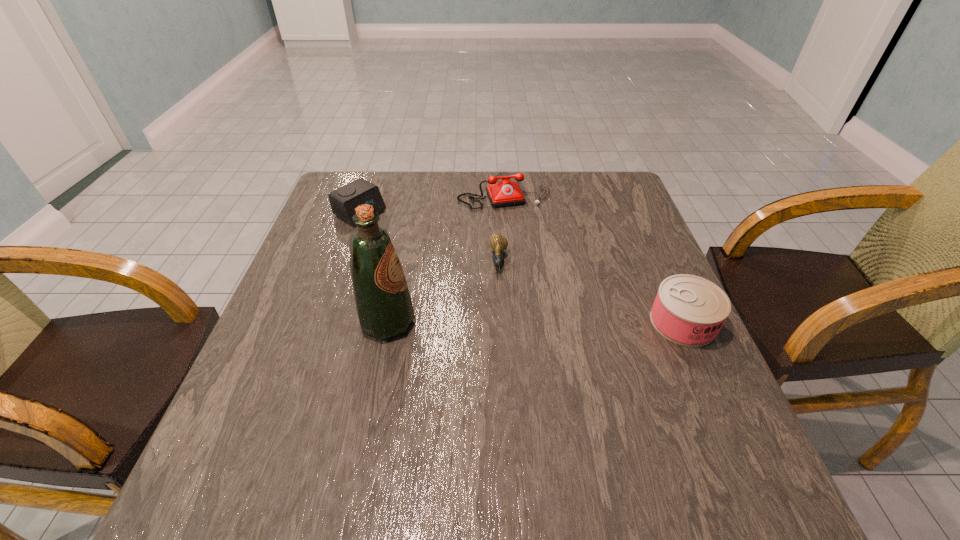
The width and height of the screenshot is (960, 540). I want to click on object present at the left edge, so click(x=344, y=200).

At what (x,y) coordinates should I click in order to perform the action: click on object that is at the right edge. Please return your answer as a coordinate pair (x, y). Looking at the image, I should click on (688, 310).

The height and width of the screenshot is (540, 960). What are the coordinates of `object located in the far left corner section of the desktop` in the screenshot? It's located at (344, 200).

In the image, there is a desktop. Identify the location of vacant region at the far edge. The width and height of the screenshot is (960, 540). (549, 173).

Find the location of a particular element. Image resolution: width=960 pixels, height=540 pixels. blank space at the near edge is located at coordinates (481, 407).

The height and width of the screenshot is (540, 960). Identify the location of free space at the left edge of the desktop. (340, 242).

Where is `vacant space at the right edge of the desktop`? vacant space at the right edge of the desktop is located at coordinates (689, 396).

Find the location of a particular element. The image size is (960, 540). blank space at the far right corner is located at coordinates (617, 178).

Identify the location of vacant space at the near right corner of the desktop. This screenshot has height=540, width=960. (716, 426).

You are a GUI agent. You are given a task and a screenshot of the screen. Output one action in this format:
    pyautogui.click(x=<x>, y=<y>)
    Task: Click on the vacant region between the escargot and the can
    
    Given the screenshot: What is the action you would take?
    pyautogui.click(x=591, y=292)